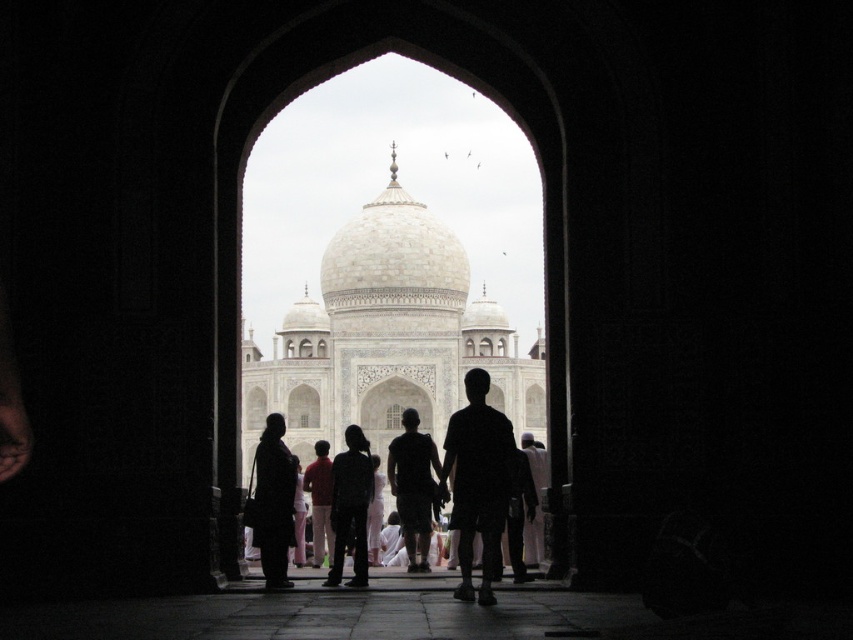
Does point (268, 580) lie behind point (428, 486)?

No, it is not.

Which is above, dark fabric dress at center or dark fabric pants at center?

dark fabric pants at center is higher up.

Does point (265, 547) come farther from viewer compared to point (397, 470)?

That is False.

Locate an element on the screen. This screenshot has width=853, height=640. dark fabric dress at center is located at coordinates (273, 500).

Is dark fabric dress at center further to camera compared to red cotton shirt at center?

That is False.

Which of these two, dark fabric dress at center or red cotton shirt at center, stands taller?

Answer: With more height is dark fabric dress at center.

The image size is (853, 640). What are the coordinates of `dark fabric dress at center` in the screenshot? It's located at (273, 500).

From the picture: Does dark fabric dress at center come behind silhouette clothing at center?

No, dark fabric dress at center is in front of silhouette clothing at center.

Consider the image. Between dark fabric dress at center and silhouette clothing at center, which one is positioned higher?

silhouette clothing at center is higher up.

Locate an element on the screen. Image resolution: width=853 pixels, height=640 pixels. dark fabric dress at center is located at coordinates (273, 500).

At what (x,y) coordinates should I click in order to perform the action: click on dark fabric dress at center. Please return your answer as a coordinate pair (x, y). The image size is (853, 640). Looking at the image, I should click on (273, 500).